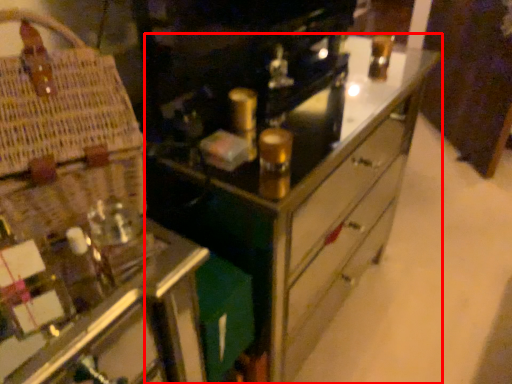
Question: From the image's perspective, what is the correct spatial relationship of chest of drawers (annotated by the red box) in relation to basket?

Choices:
 (A) below
 (B) above

Answer: (A)